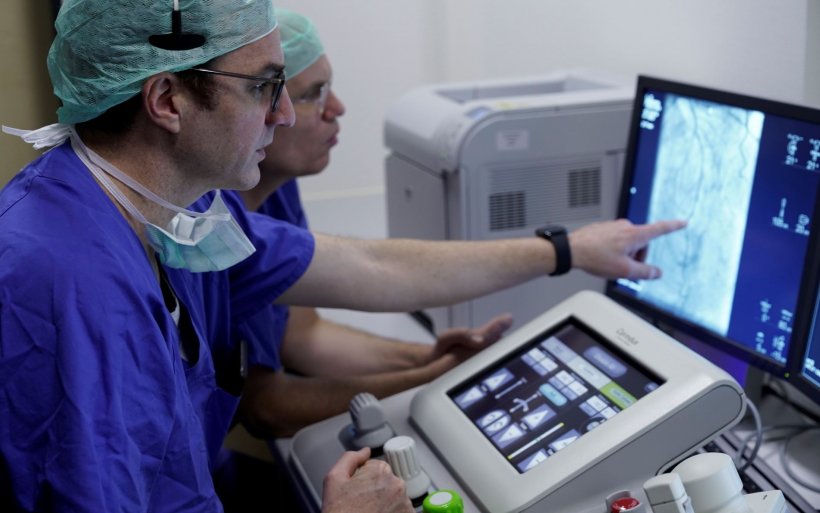
The width and height of the screenshot is (820, 513). I want to click on monitor, so click(727, 235).